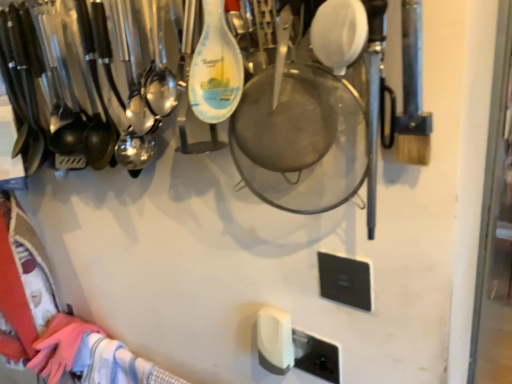
Question: Can we say black plastic light switch at lower right, the 1th light switch when ordered from right to left, lies outside white plastic light switch at lower center, positioned as the 2th light switch in right-to-left order?

Choices:
 (A) yes
 (B) no

Answer: (A)

Question: Could you tell me if black plastic light switch at lower right, the second light switch viewed from the left, is facing white plastic light switch at lower center, the 1th light switch in the back-to-front sequence?

Choices:
 (A) no
 (B) yes

Answer: (A)

Question: Can you confirm if black plastic light switch at lower right, the 2th light switch ordered from the bottom, is shorter than white plastic light switch at lower center, the first light switch in the left-to-right sequence?

Choices:
 (A) no
 (B) yes

Answer: (B)

Question: Can you confirm if black plastic light switch at lower right, the 1th light switch when ordered from right to left, is bigger than white plastic light switch at lower center, the first light switch in the left-to-right sequence?

Choices:
 (A) yes
 (B) no

Answer: (B)

Question: From a real-world perspective, is black plastic light switch at lower right, the second light switch viewed from the left, under white plastic light switch at lower center, positioned as the second light switch in front-to-back order?

Choices:
 (A) no
 (B) yes

Answer: (A)

Question: Does black plastic light switch at lower right, the second light switch viewed from the left, touch white plastic light switch at lower center, which appears as the second light switch when viewed from the top?

Choices:
 (A) no
 (B) yes

Answer: (A)

Question: From the image's perspective, is white plastic light switch at lower center, the first light switch in the left-to-right sequence, beneath black plastic light switch at lower right, which appears as the 1th light switch when viewed from the front?

Choices:
 (A) no
 (B) yes

Answer: (B)

Question: Is white plastic light switch at lower center, which appears as the second light switch when viewed from the top, further to camera compared to black plastic light switch at lower right, the 2th light switch ordered from the bottom?

Choices:
 (A) no
 (B) yes

Answer: (B)

Question: Is black plastic light switch at lower right, the 1th light switch when ordered from right to left, a part of white plastic light switch at lower center, the first light switch in the left-to-right sequence?

Choices:
 (A) no
 (B) yes

Answer: (A)

Question: Is white plastic light switch at lower center, positioned as the second light switch in front-to-back order, far from black plastic light switch at lower right, the 2th light switch in the back-to-front sequence?

Choices:
 (A) no
 (B) yes

Answer: (A)

Question: Can you confirm if white plastic light switch at lower center, positioned as the second light switch in front-to-back order, is taller than black plastic light switch at lower right, the first light switch when ordered from top to bottom?

Choices:
 (A) yes
 (B) no

Answer: (A)

Question: Could you tell me if white plastic light switch at lower center, the first light switch ordered from the bottom, is facing black plastic light switch at lower right, the 2th light switch in the back-to-front sequence?

Choices:
 (A) no
 (B) yes

Answer: (A)

Question: Is point (x=283, y=349) positioned closer to the camera than point (x=344, y=302)?

Choices:
 (A) farther
 (B) closer

Answer: (A)